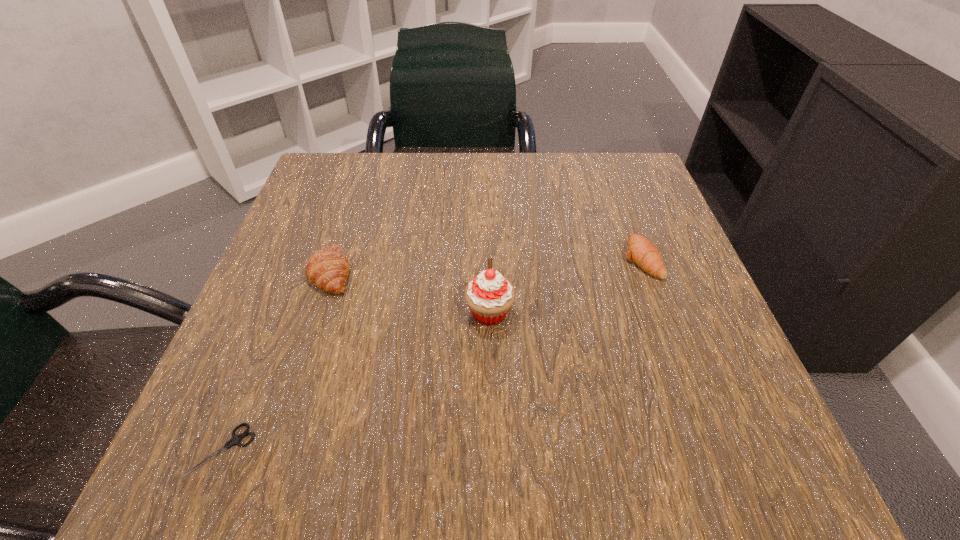
The height and width of the screenshot is (540, 960). I want to click on vacant space that's between the taller crescent roll and the nearest object, so click(276, 361).

Locate an element on the screen. Image resolution: width=960 pixels, height=540 pixels. vacant space in between the rightmost object and the cupcake is located at coordinates (564, 286).

Where is `vacant area that lies between the tallest object and the third tallest object`? The width and height of the screenshot is (960, 540). vacant area that lies between the tallest object and the third tallest object is located at coordinates (564, 286).

Where is `vacant point located between the shears and the second object from right to left`? vacant point located between the shears and the second object from right to left is located at coordinates (355, 382).

The width and height of the screenshot is (960, 540). Identify the location of object that is the closest to the third object from left to right. (327, 269).

This screenshot has width=960, height=540. I want to click on object that is the closest to the tallest object, so click(327, 269).

Where is `free location that satisfies the following two spatial constraints: 1. on the back side of the third tallest object; 2. on the left side of the nearest object`? This screenshot has height=540, width=960. free location that satisfies the following two spatial constraints: 1. on the back side of the third tallest object; 2. on the left side of the nearest object is located at coordinates (300, 259).

Where is `vacant space that satisfies the following two spatial constraints: 1. on the back side of the rightmost object; 2. on the left side of the second object from right to left`? This screenshot has width=960, height=540. vacant space that satisfies the following two spatial constraints: 1. on the back side of the rightmost object; 2. on the left side of the second object from right to left is located at coordinates (489, 259).